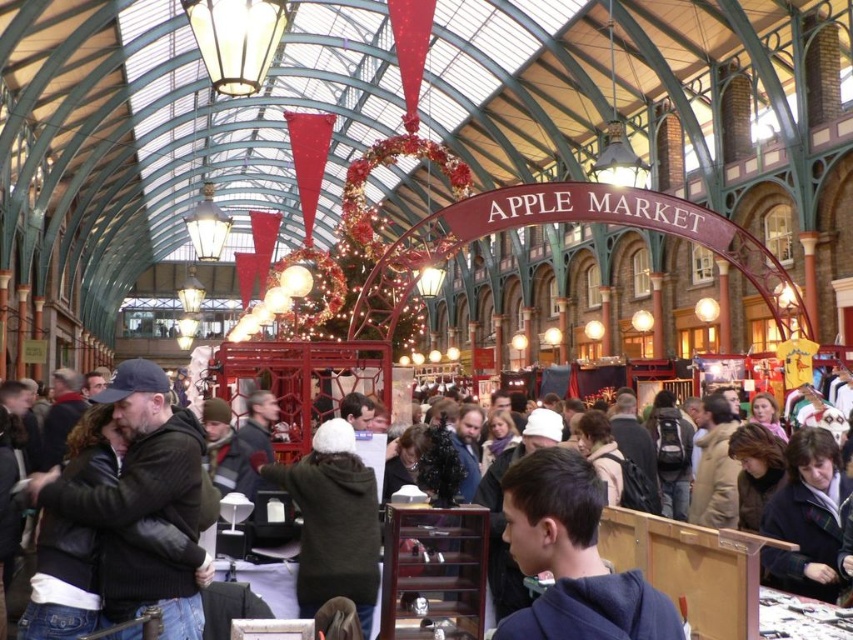
Identify the location of dark brown sweater at center. (123, 518).

Which is in front, point (160, 372) or point (577, 472)?

Point (577, 472) is more forward.

Identify the location of dark brown sweater at center. The image size is (853, 640). (123, 518).

Between point (576, 512) and point (686, 556), which one is positioned behind?

Point (686, 556)

Does dark blue hoodie at center appear under dark brown leather jacket at center?

Correct, dark blue hoodie at center is located below dark brown leather jacket at center.

Does point (648, 588) come farther from viewer compared to point (602, 515)?

No, (648, 588) is closer to viewer.

Identify the location of dark blue hoodie at center. (572, 557).

Can you confirm if dark brown sweater at center is taller than dark brown leather jacket at center?

No.

Between dark brown sweater at center and dark brown leather jacket at center, which one has more height?

dark brown leather jacket at center is taller.

Is point (39, 540) positioned in front of point (701, 577)?

That is False.

The width and height of the screenshot is (853, 640). Identify the location of dark brown sweater at center. (123, 518).